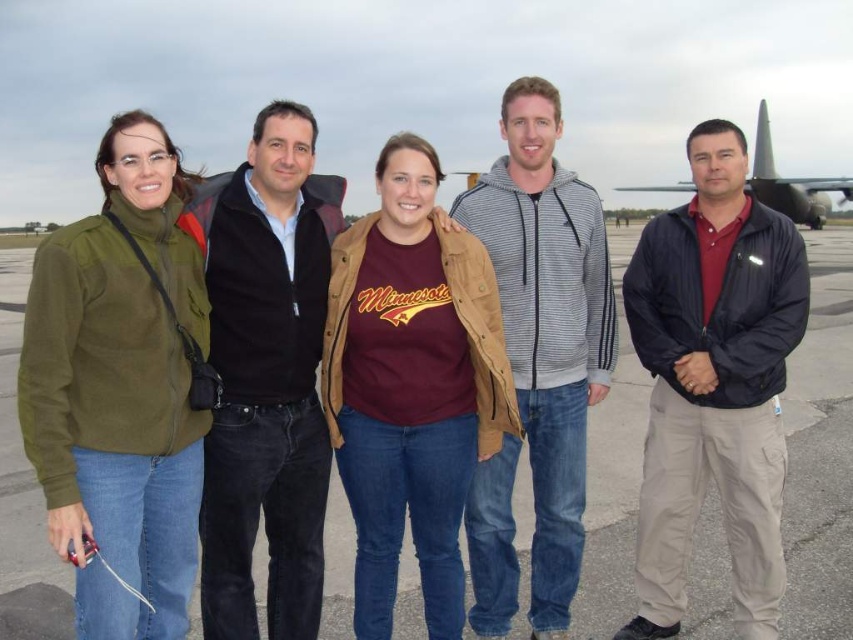
You are a photographer trying to capture a group photo of the five individuals on the tarmac. You need to position your camera so that the dark blue jacket at right is centered in the frame. What coordinate should you aim for?

The dark blue jacket at right is located at coordinate point [714,381], so you should aim your camera at that coordinate to center it in the frame.

You are a photographer trying to capture a photo of the metallic gray airplane at right. There is a person wearing a dark blue jacket at right blocking your view. Can you move to the left to get a better shot of the airplane?

The dark blue jacket at right is positioned on the left side of the metallic gray airplane at right. Moving to the left would place you further away from the airplane, so it might not help. Alternatively, moving to the right could allow you to see around the person in the dark blue jacket at right.

You are a photographer positioned at the camera location. You want to take a photo that includes both the point at (258, 259) and the point at (548, 458). Which point is closer to your current position?

The point at (258, 259) is closer to the camera than the point at (548, 458), so it will appear nearer in the photo.